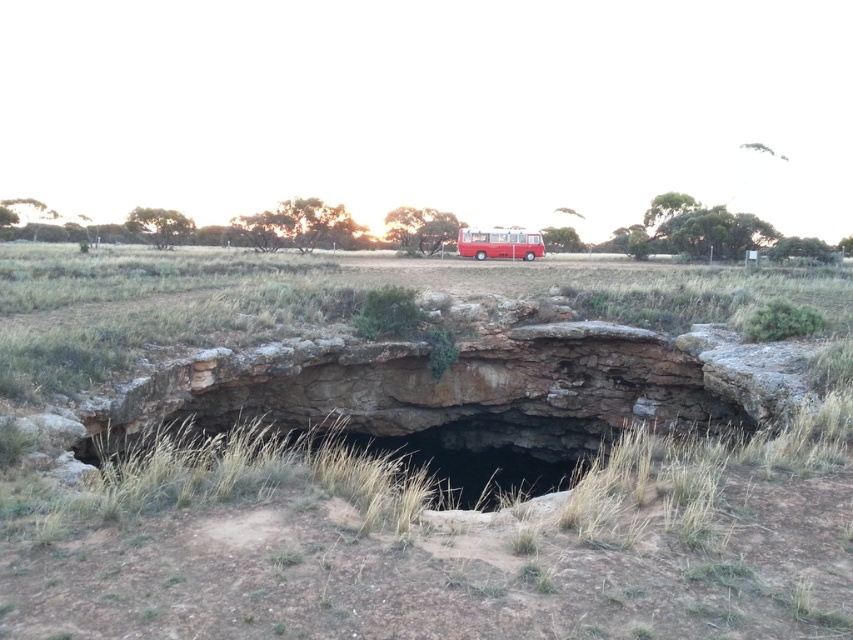
You are a hiker standing at the cave entrance and want to reach the matte red bus at center. Which direction should you move relative to the dry grass at center to get there?

The matte red bus at center is farther from the viewer than the dry grass at center. To reach the matte red bus at center, you should move away from the dry grass at center.

You are a photographer standing at the camera position. You want to capture a photo of the dry grass at center without including the cave entrance in the frame. Is the distance sufficient to avoid including the cave entrance?

The dry grass at center is 11.30 feet away from the camera. Since the cave entrance is in the foreground, it is likely closer to the camera than the dry grass. Therefore, moving back or adjusting the angle might be necessary to exclude the cave entrance from the photo.